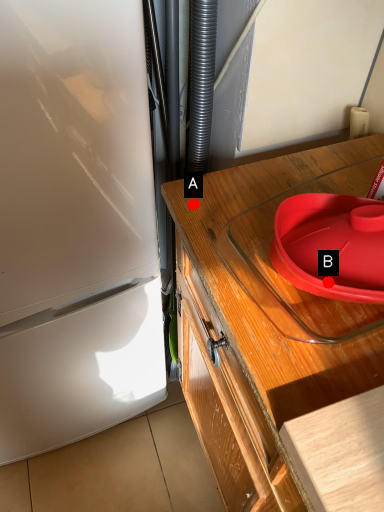
Question: Two points are circled on the image, labeled by A and B beside each circle. Among these points, which one is nearest to the camera?

Choices:
 (A) A is closer
 (B) B is closer

Answer: (B)